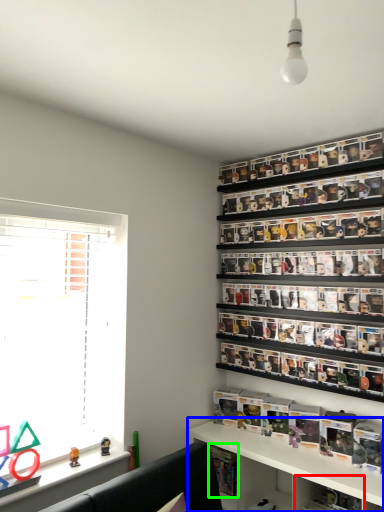
Question: Which object is positioned farthest from cabinet (highlighted by a red box)? Select from shelf (highlighted by a blue box) and book (highlighted by a green box).

Choices:
 (A) shelf
 (B) book

Answer: (B)